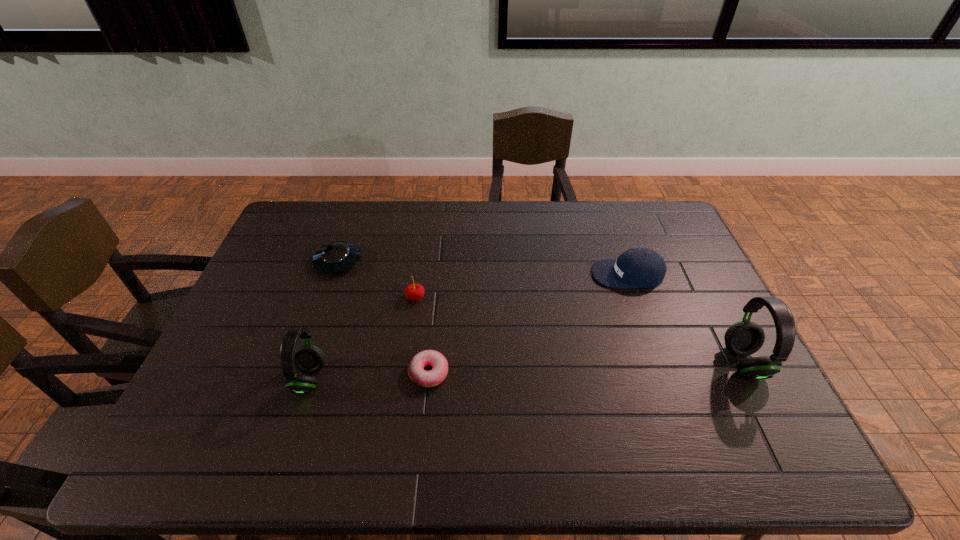
This screenshot has width=960, height=540. Find the location of `vacant space located 0.080m on the ear cups of the shorter headset`. vacant space located 0.080m on the ear cups of the shorter headset is located at coordinates (262, 379).

The image size is (960, 540). What are the coordinates of `free space located on the ear cups of the shorter headset` in the screenshot? It's located at (258, 379).

Image resolution: width=960 pixels, height=540 pixels. What are the coordinates of `vacant space positioned 0.260m on the ear cups of the taller headset` in the screenshot? It's located at (627, 362).

Find the location of a particular element. vacant region located 0.100m on the ear cups of the taller headset is located at coordinates (687, 362).

What are the coordinates of `vacant point located 0.370m on the ear cups of the taller headset` in the screenshot? It's located at (585, 362).

The width and height of the screenshot is (960, 540). In order to click on free spot located on the front of the saucer in this screenshot , I will do `click(325, 299)`.

You are a GUI agent. You are given a task and a screenshot of the screen. Output one action in this format:
    pyautogui.click(x=<x>, y=<y>)
    Task: Click on the vacant area situated 0.060m on the front-facing side of the second object from right to left
    
    Given the screenshot: What is the action you would take?
    pyautogui.click(x=573, y=274)

You are a GUI agent. You are given a task and a screenshot of the screen. Output one action in this format:
    pyautogui.click(x=<x>, y=<y>)
    Task: Click on the vacant space located on the front-facing side of the second object from right to left
    The width and height of the screenshot is (960, 540).
    Given the screenshot: What is the action you would take?
    pyautogui.click(x=566, y=274)

Find the location of a particular element. The height and width of the screenshot is (540, 960). free space located 0.170m on the front-facing side of the second object from right to left is located at coordinates (539, 274).

Locate an element on the screen. The image size is (960, 540). free space located on the back of the cherry is located at coordinates (427, 219).